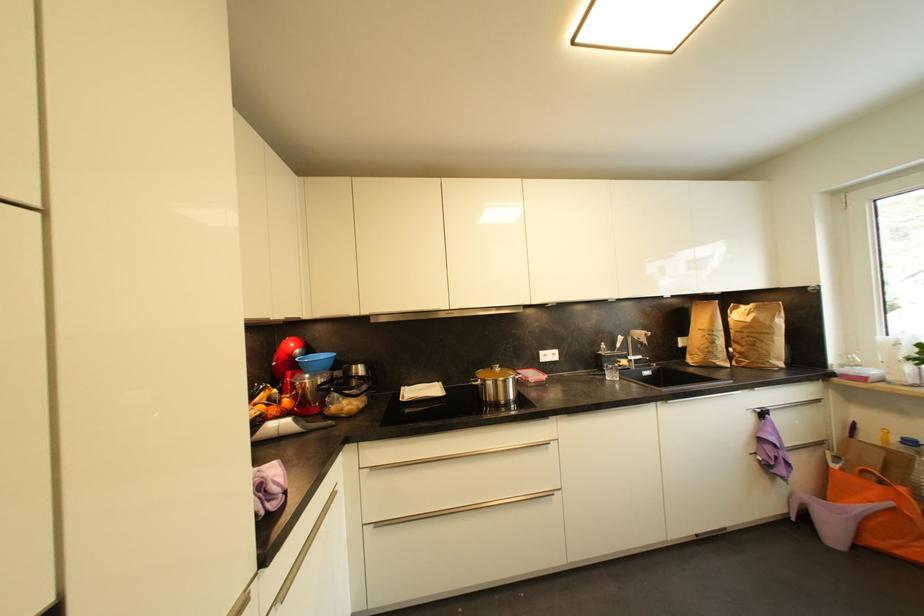
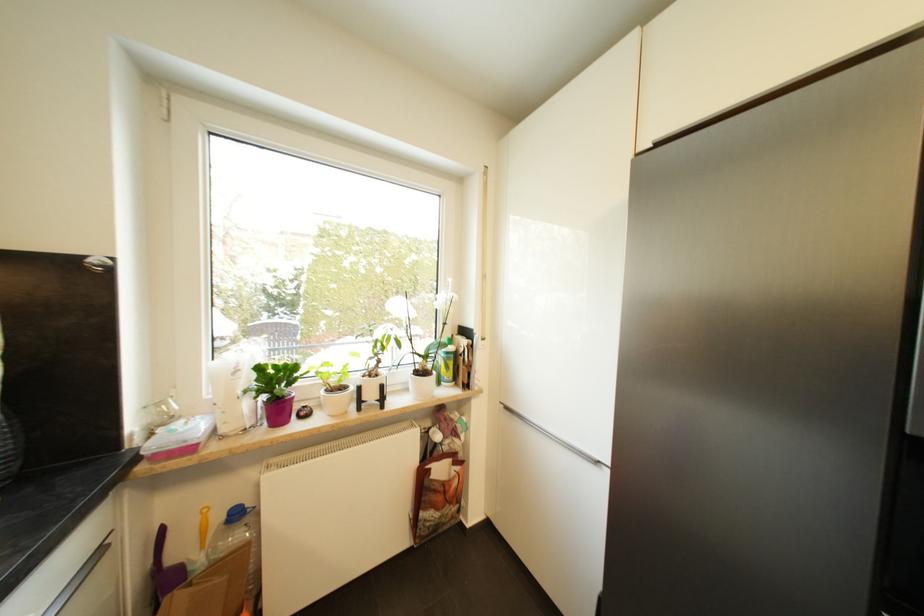
Where in the second image is the point corresponding to point 868,382 from the first image?

(195, 451)